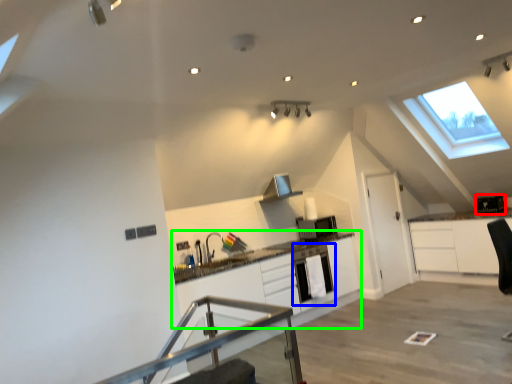
Question: Which is nearer to the appliance (highlighted by a red box)? dish washer (highlighted by a blue box) or cabinetry (highlighted by a green box).

Choices:
 (A) dish washer
 (B) cabinetry

Answer: (A)